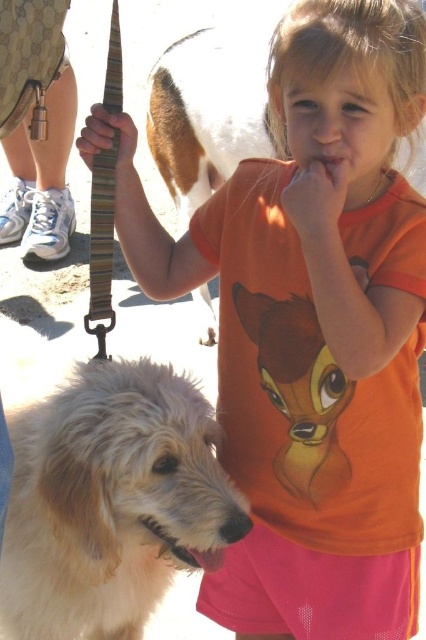
Question: Which object is closer to the camera taking this photo?

Choices:
 (A) white fluffy dog at center
 (B) white fur dog at center

Answer: (A)

Question: Does white fluffy dog at center appear on the right side of white fur dog at center?

Choices:
 (A) no
 (B) yes

Answer: (A)

Question: Is white fluffy dog at center positioned at the back of white fur dog at center?

Choices:
 (A) yes
 (B) no

Answer: (B)

Question: From the image, what is the correct spatial relationship of white fluffy dog at center in relation to white fur dog at center?

Choices:
 (A) above
 (B) below

Answer: (B)